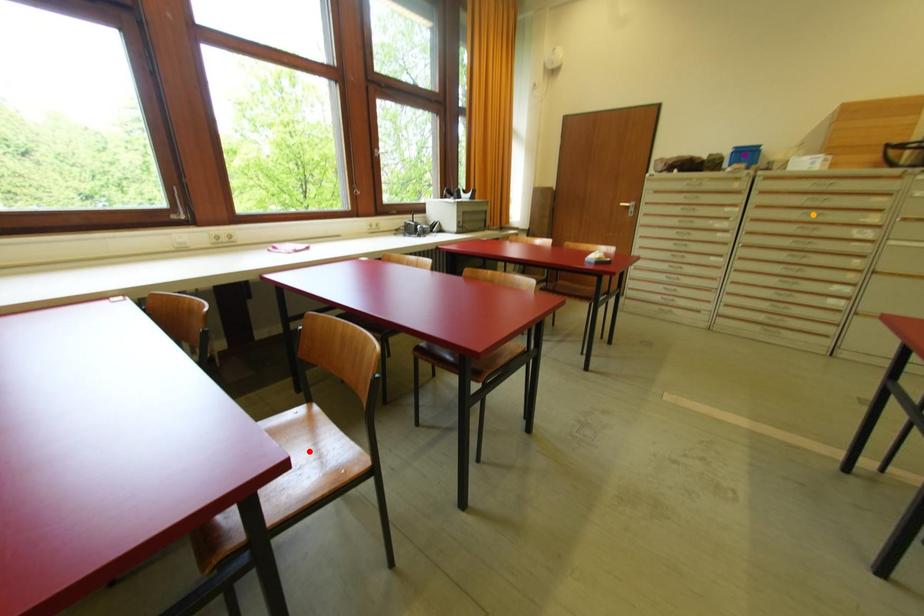
Order these from nearest to farthest:
- purple point
- orange point
- red point

red point, orange point, purple point